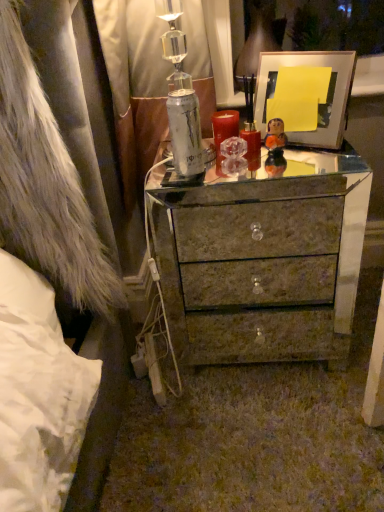
Question: Is marble-like drawer at center wider or thinner than shiny metallic chest of drawers at center?

Choices:
 (A) wide
 (B) thin

Answer: (B)

Question: Choose the correct answer: Is marble-like drawer at center inside shiny metallic chest of drawers at center or outside it?

Choices:
 (A) inside
 (B) outside

Answer: (B)

Question: Estimate the real-world distances between objects in this image. Which object is farther from the marble-like drawer at center?

Choices:
 (A) matte white picture frame at upper right
 (B) shiny metallic chest of drawers at center
 (C) fuzzy white fur coat at left

Answer: (C)

Question: Which object is positioned closest to the marble-like drawer at center?

Choices:
 (A) fuzzy white fur coat at left
 (B) matte white picture frame at upper right
 (C) shiny metallic chest of drawers at center

Answer: (C)